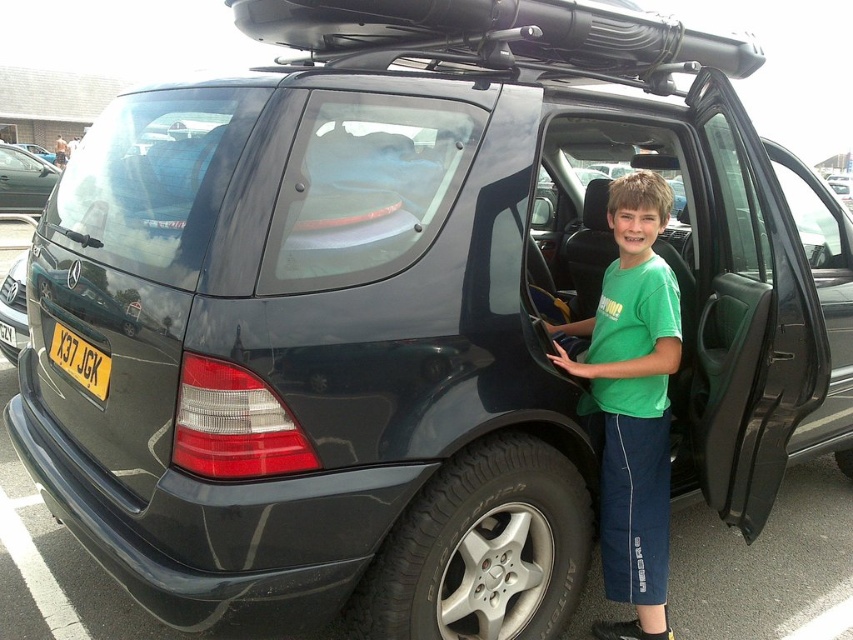
Question: Among these objects, which one is farthest from the camera?

Choices:
 (A) black rubber tire at lower center
 (B) green cotton shirt at center
 (C) yellow plastic license plate at rear

Answer: (B)

Question: Where is metallic silver car at left located in relation to yellow plastic license plate at rear in the image?

Choices:
 (A) right
 (B) left

Answer: (B)

Question: Does green cotton shirt at center have a smaller size compared to yellow plastic license plate at rear?

Choices:
 (A) no
 (B) yes

Answer: (A)

Question: Which point is farther to the camera?

Choices:
 (A) black rubber tire at lower center
 (B) yellow plastic license plate at rear
 (C) metallic silver car at left
 (D) green cotton shirt at center

Answer: (C)

Question: Is green cotton shirt at center smaller than yellow plastic license plate at rear?

Choices:
 (A) yes
 (B) no

Answer: (B)

Question: Which object appears closest to the camera in this image?

Choices:
 (A) green cotton shirt at center
 (B) yellow plastic license plate at rear

Answer: (B)